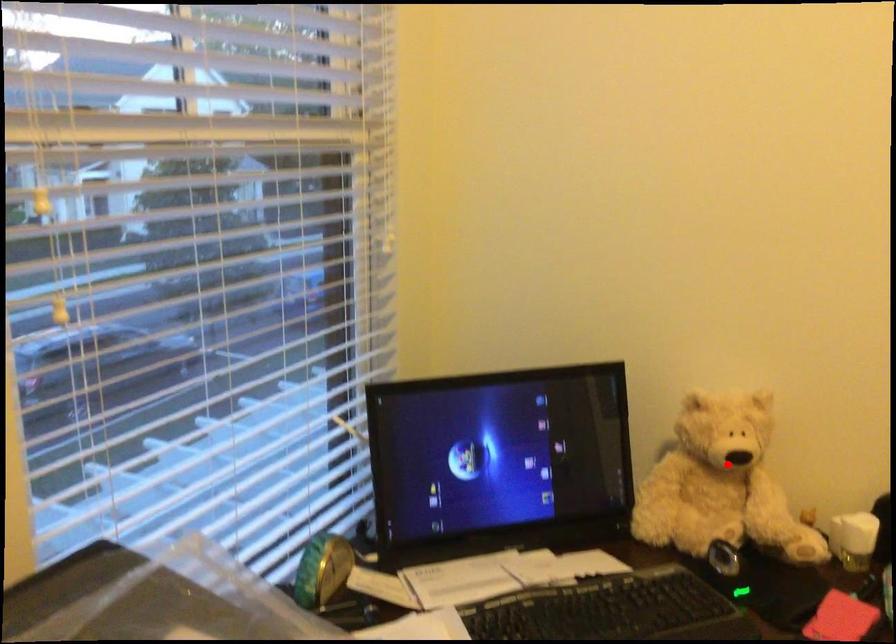
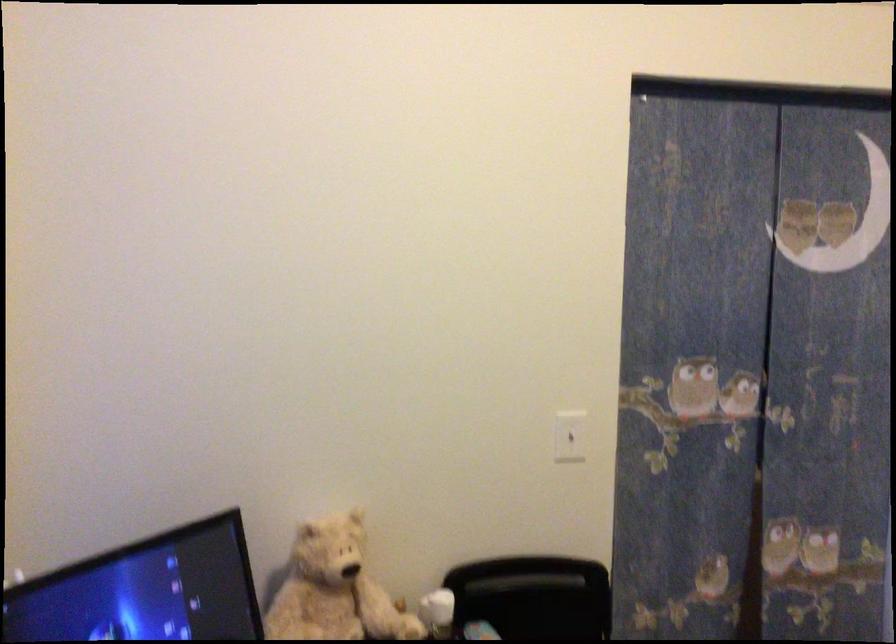
Locate, in the second image, the point that corresponds to the highlighted location in the first image.

(334, 589)